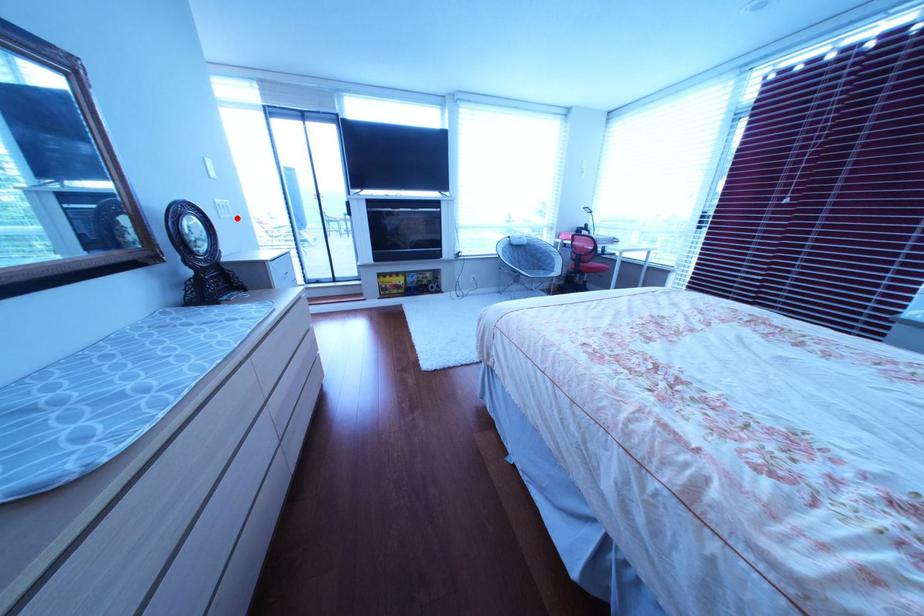
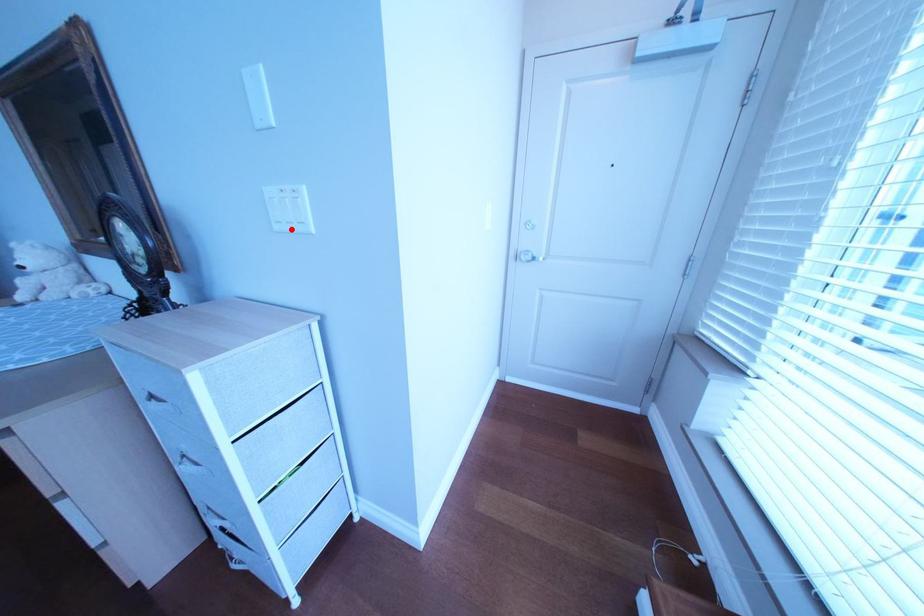
I am providing you with two images of the same scene from different viewpoints. A red point is marked on the first image and another point is marked on the second image. Does the point marked in image1 correspond to the same location as the one in image2?

Yes